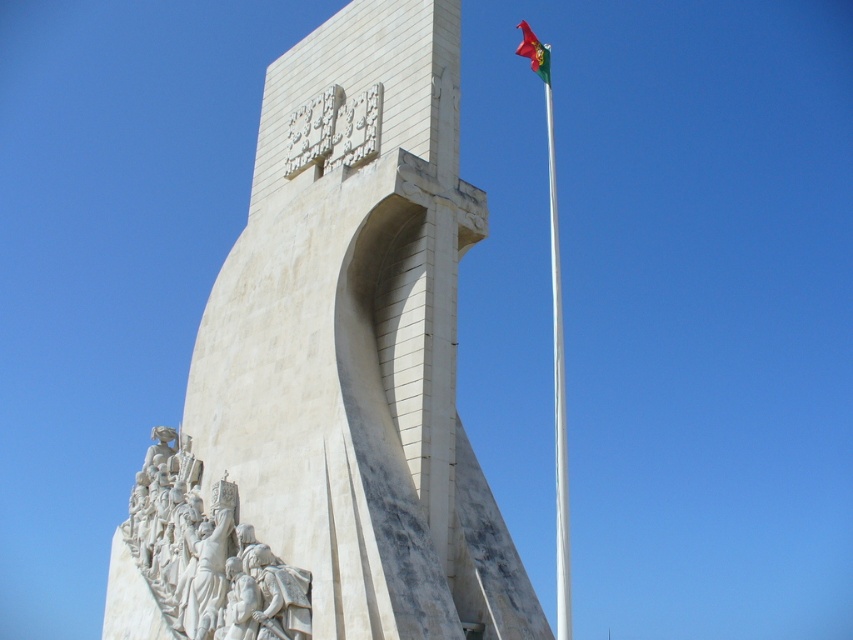
Question: Can you confirm if white marble relief at lower left is positioned below red fabric flag at upper right?

Choices:
 (A) no
 (B) yes

Answer: (B)

Question: Which point is farther from the camera taking this photo?

Choices:
 (A) (543, 76)
 (B) (189, 582)

Answer: (A)

Question: Is the position of white marble monument at center more distant than that of white marble relief at lower left?

Choices:
 (A) no
 (B) yes

Answer: (A)

Question: Is white marble monument at center closer to the viewer compared to red fabric flag at upper right?

Choices:
 (A) yes
 (B) no

Answer: (A)

Question: Which point is closer to the camera?

Choices:
 (A) (161, 545)
 (B) (534, 52)
 (C) (488, 612)

Answer: (C)

Question: Among these points, which one is farthest from the camera?

Choices:
 (A) (532, 44)
 (B) (321, 438)

Answer: (A)